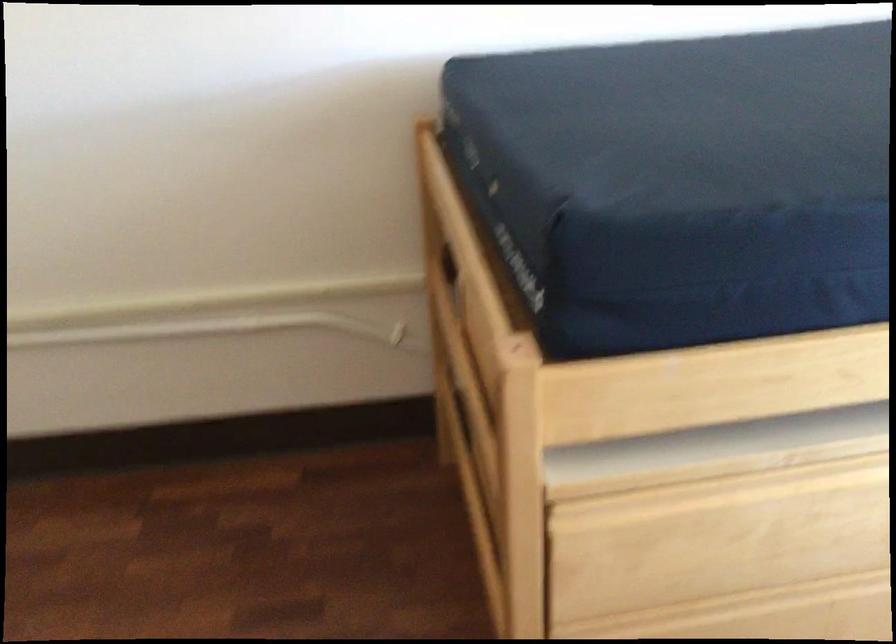
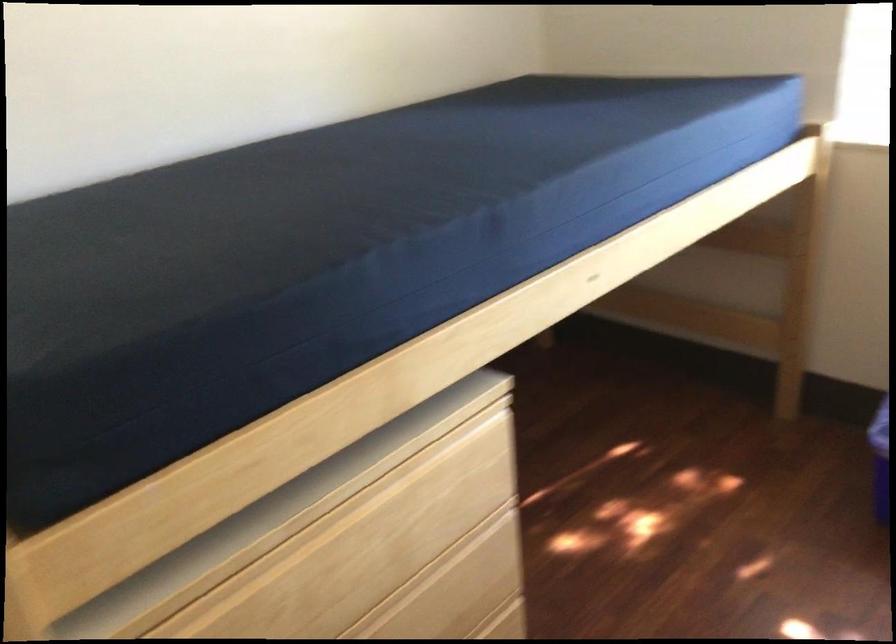
Question: The first image is from the beginning of the video and the second image is from the end. How did the camera likely rotate when shooting the video?

Choices:
 (A) Left
 (B) Right
 (C) Up
 (D) Down

Answer: (B)